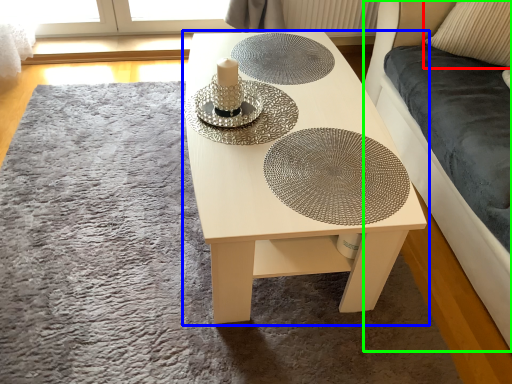
Question: Considering the real-world distances, which object is closest to pillow (highlighted by a red box)? table (highlighted by a blue box) or couch (highlighted by a green box).

Choices:
 (A) table
 (B) couch

Answer: (B)